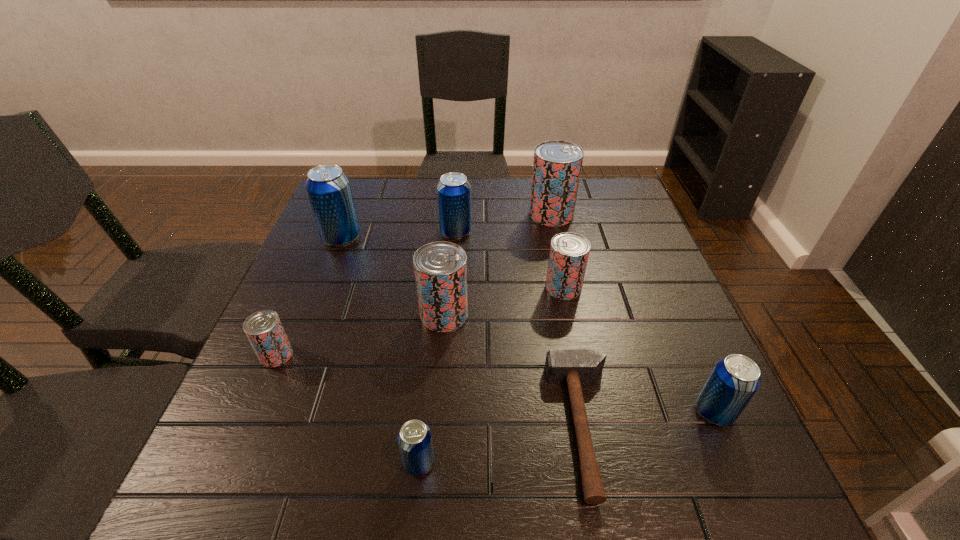
The image size is (960, 540). Find the location of `blank region between the nearest beer can and the second smallest red beer can`. blank region between the nearest beer can and the second smallest red beer can is located at coordinates [x=492, y=375].

What are the coordinates of `unoccupied position between the nearest beer can and the leftmost blue beer can` in the screenshot? It's located at (380, 350).

What are the coordinates of `the third closest object to the third smallest blue beer can` in the screenshot? It's located at 440,268.

Choose which object is the fifth nearest neighbor to the second nearest beer can. Please provide its 2D coordinates. Your answer should be formatted as a tuple, i.e. [(x, y)], where the tuple contains the x and y coordinates of a point satisfying the conditions above.

[(557, 164)]

Select which beer can is the second closest to the second smallest blue beer can. Please provide its 2D coordinates. Your answer should be formatted as a tuple, i.e. [(x, y)], where the tuple contains the x and y coordinates of a point satisfying the conditions above.

[(440, 268)]

Identify which beer can is located as the third nearest to the biggest red beer can. Please provide its 2D coordinates. Your answer should be formatted as a tuple, i.e. [(x, y)], where the tuple contains the x and y coordinates of a point satisfying the conditions above.

[(440, 268)]

Identify which red beer can is located as the third nearest to the nearest blue beer can. Please provide its 2D coordinates. Your answer should be formatted as a tuple, i.e. [(x, y)], where the tuple contains the x and y coordinates of a point satisfying the conditions above.

[(569, 252)]

The height and width of the screenshot is (540, 960). Find the location of `the closest red beer can to the shortest object`. the closest red beer can to the shortest object is located at coordinates (440, 268).

I want to click on the second closest blue beer can relative to the third red beer can from right to left, so 414,439.

Find the location of a particular element. The image size is (960, 540). blue beer can that is the second closest one to the smallest blue beer can is located at coordinates (328, 188).